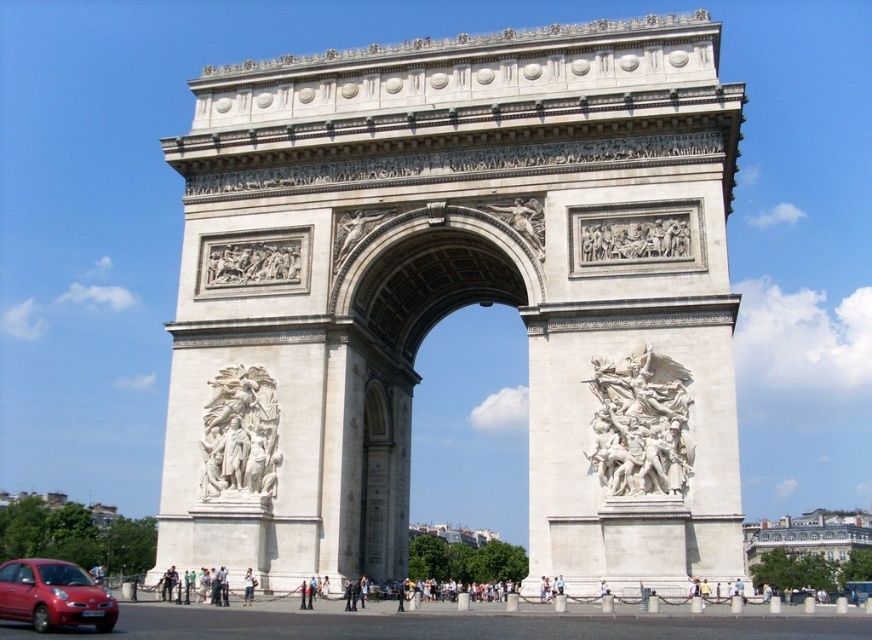
Can you confirm if white marble sculpture at center is taller than light brown leather jacket at center?

In fact, white marble sculpture at center may be shorter than light brown leather jacket at center.

Can you confirm if white marble sculpture at center is shorter than light brown leather jacket at center?

Correct, white marble sculpture at center is not as tall as light brown leather jacket at center.

Identify the location of white marble sculpture at center. (641, 422).

The height and width of the screenshot is (640, 872). What are the coordinates of `white marble sculpture at center` in the screenshot? It's located at (641, 422).

Does white marble relief at center lie in front of light brown leather jacket at center?

That is False.

Does white marble relief at center have a smaller size compared to light brown leather jacket at center?

Indeed, white marble relief at center has a smaller size compared to light brown leather jacket at center.

Where is `white marble relief at center`? The image size is (872, 640). white marble relief at center is located at coordinates (240, 433).

Locate an element on the screen. The height and width of the screenshot is (640, 872). white marble relief at center is located at coordinates (240, 433).

Is white stone arch at center bigger than matte red car at lower left?

Indeed, white stone arch at center has a larger size compared to matte red car at lower left.

Is white stone arch at center below matte red car at lower left?

Actually, white stone arch at center is above matte red car at lower left.

You are a GUI agent. You are given a task and a screenshot of the screen. Output one action in this format:
    pyautogui.click(x=<x>, y=<y>)
    Task: Click on the white stone arch at center
    
    Given the screenshot: What is the action you would take?
    pyautogui.click(x=467, y=291)